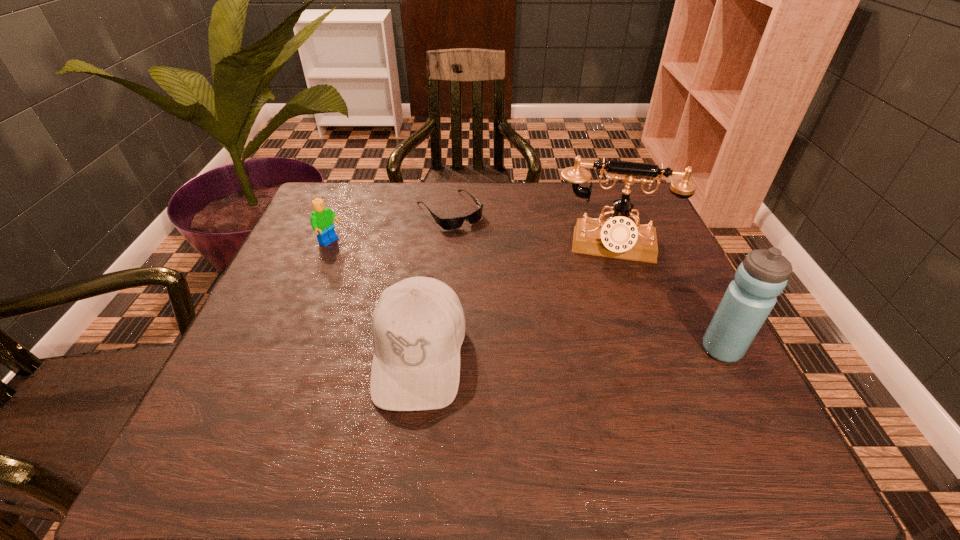
This screenshot has height=540, width=960. In order to click on blank region between the water bottle and the Lego in this screenshot , I will do `click(526, 296)`.

The height and width of the screenshot is (540, 960). I want to click on free space between the leftmost object and the water bottle, so click(x=526, y=296).

Locate an element on the screen. Image resolution: width=960 pixels, height=540 pixels. free space that is in between the baseball cap and the telephone is located at coordinates (515, 300).

Image resolution: width=960 pixels, height=540 pixels. I want to click on vacant region between the shortest object and the water bottle, so click(586, 280).

Where is `vacant space that's between the baseball cap and the Lego`? vacant space that's between the baseball cap and the Lego is located at coordinates (374, 299).

Where is `unoccupied area between the telephone and the sunglasses`? This screenshot has height=540, width=960. unoccupied area between the telephone and the sunglasses is located at coordinates (531, 227).

I want to click on object that can be found as the third closest to the leftmost object, so click(619, 237).

The width and height of the screenshot is (960, 540). Identify the location of the fourth closest object relative to the telephone. (322, 218).